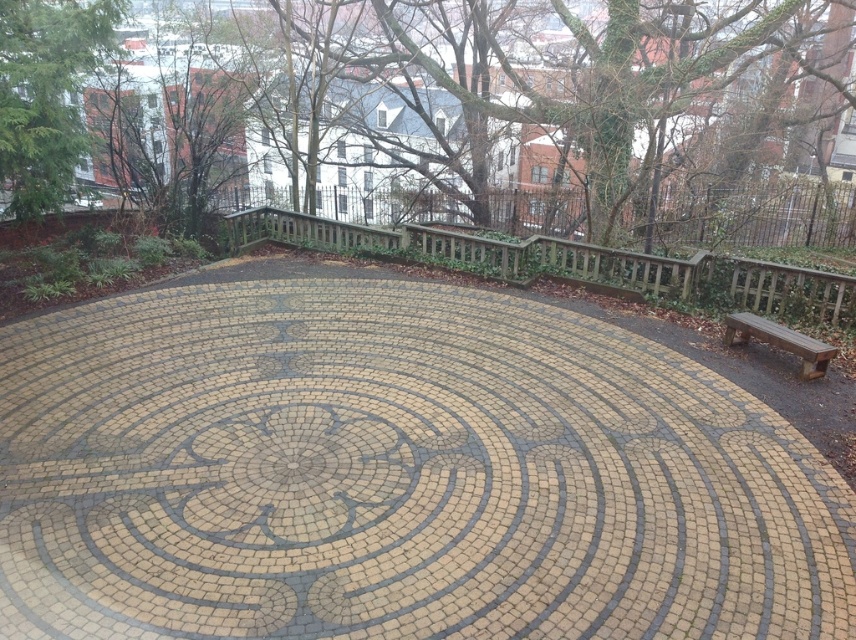
You are a visitor standing at the entrance of the labyrinth and see the wooden at center and the brown wooden bench at lower right. Which object is taller?

The wooden at center is taller than the brown wooden bench at lower right.

You are standing at the entrance of the circular stone labyrinth and want to reach the wooden structure at the center. According to the labyrinth layout, is the wooden at center directly ahead or to the side of your current position?

The wooden at center is located at point 0.412 on the x and 0.666 on the y coordinate. Since the entrance is typically at the outer edge, the wooden at center would be directly ahead as the central point of the labyrinth.

You are standing at the entrance of the labyrinth and see the wooden at center and the brown wooden bench at lower right. Which object is closer to the central point of the labyrinth?

The wooden at center is closer to the central point of the labyrinth because it is located above the brown wooden bench at lower right, meaning it is positioned nearer to the center.